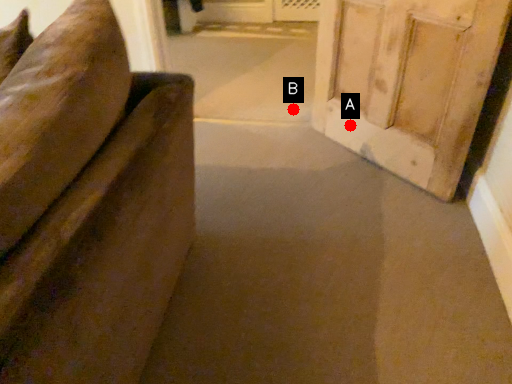
Question: Two points are circled on the image, labeled by A and B beside each circle. Which point is closer to the camera?

Choices:
 (A) A is closer
 (B) B is closer

Answer: (A)